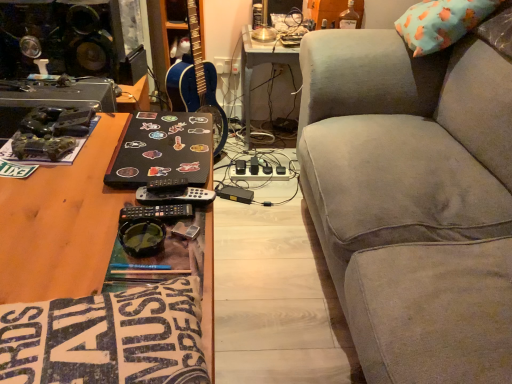
The height and width of the screenshot is (384, 512). Identify the location of free space to the right of green rubber goggles at center. (194, 245).